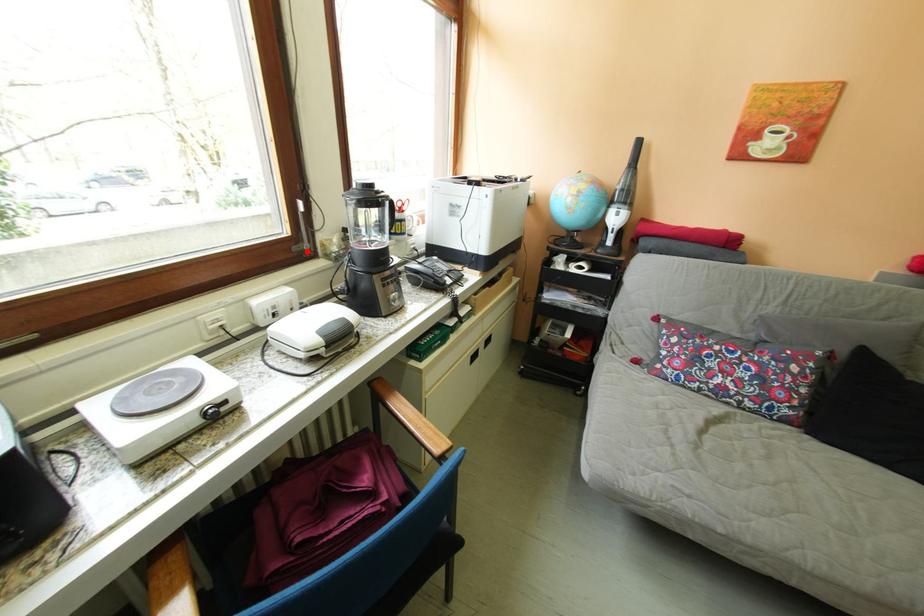
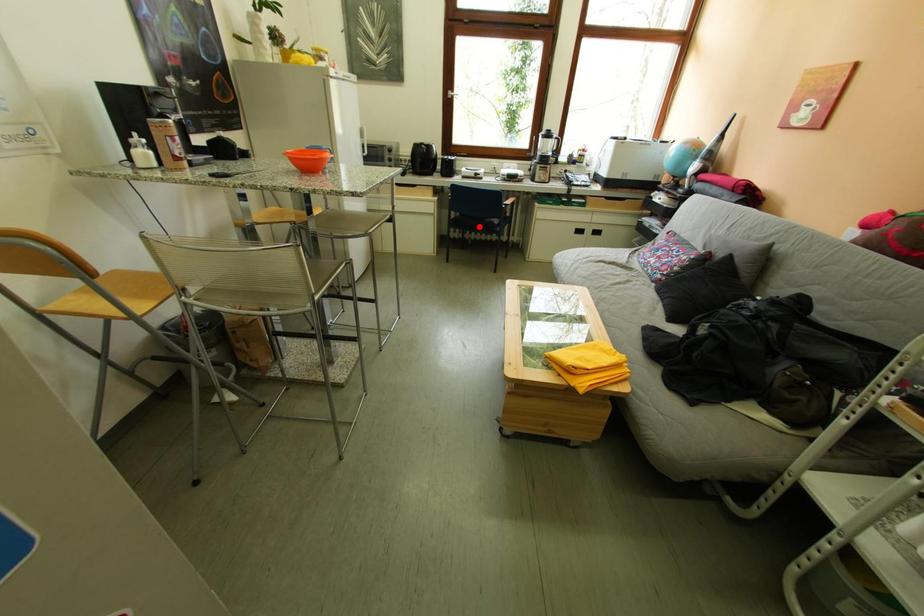
I am providing you with two images of the same scene from different viewpoints. A red point is marked on the first image and another point is marked on the second image. Are the points marked in image1 and image2 representing the same 3D position?

No